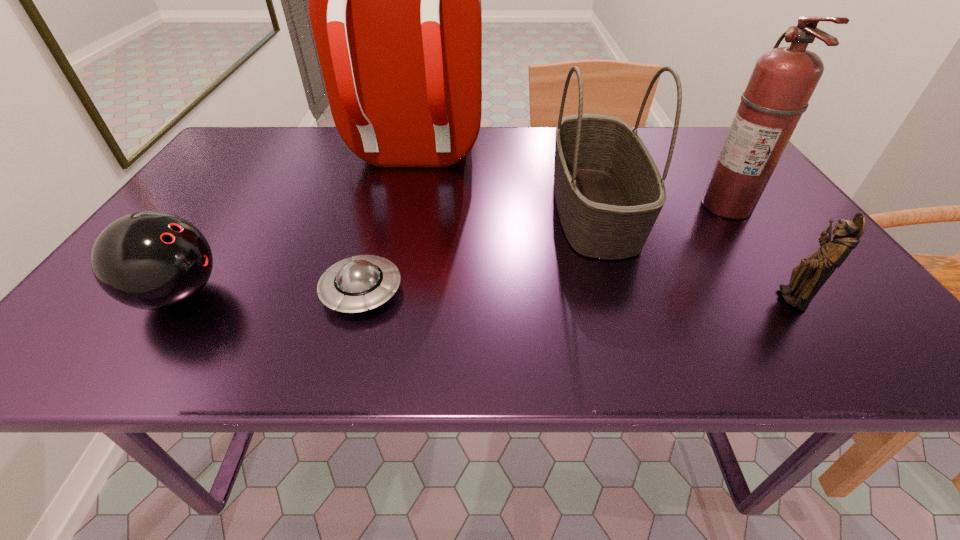
Find the location of `object that is at the left edge`. object that is at the left edge is located at coordinates (150, 260).

Find the location of a particular element. fire extinguisher at the right edge is located at coordinates (783, 80).

This screenshot has width=960, height=540. I want to click on figurine present at the right edge, so click(807, 278).

You are a GUI agent. You are given a task and a screenshot of the screen. Output one action in this format:
    pyautogui.click(x=<x>, y=<y>)
    Task: Click on the object present at the near left corner
    The image size is (960, 540).
    Given the screenshot: What is the action you would take?
    pyautogui.click(x=150, y=260)

Locate an element on the screen. free space at the near edge is located at coordinates (488, 361).

Identify the location of vacant space at the left edge of the desktop. The height and width of the screenshot is (540, 960). (196, 210).

Locate an element on the screen. The height and width of the screenshot is (540, 960). free space at the right edge is located at coordinates (778, 262).

Find the location of `vacant space at the far left corner of the desktop`. vacant space at the far left corner of the desktop is located at coordinates (263, 164).

Image resolution: width=960 pixels, height=540 pixels. Identify the location of free space at the near right corner of the desktop. (838, 330).

Identify the location of vacant point located between the figurine and the bowling ball. (485, 296).